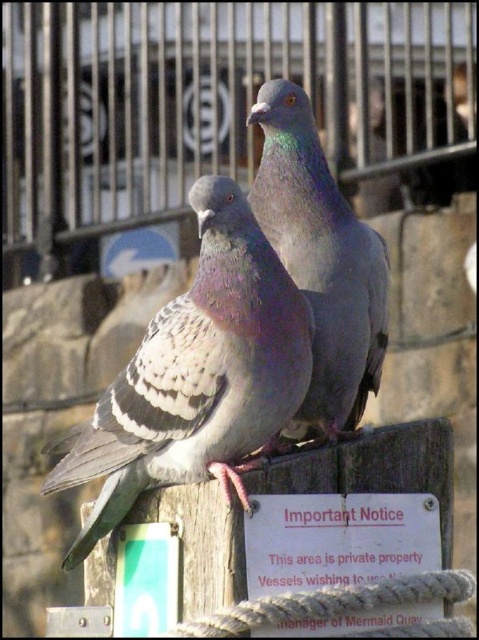
You are a photographer trying to capture a clear shot of the gray matte pigeon at center without the brushed metal fence at upper center appearing in the frame. Based on their positions, is this possible?

The brushed metal fence at upper center is to the left of the gray matte pigeon at center, so adjusting the camera angle to the right side of the pigeon would exclude the fence from the frame.

You are a delivery drone flying towards the gray matte pigeon at center. There is a brushed metal fence at upper center in your path. Will you need to adjust your flight path to avoid hitting the fence?

The brushed metal fence at upper center is above the gray matte pigeon at center, so the drone will not need to adjust its path as the fence is positioned higher and would not block the direct route to the pigeon.

You are a birdwatcher observing two pigeons on a wooden post. You notice the speckled feathered pigeon at center and the gray feathered pigeon at center. Which pigeon has a smaller body width?

The speckled feathered pigeon at center has a smaller body width than the gray feathered pigeon at center.